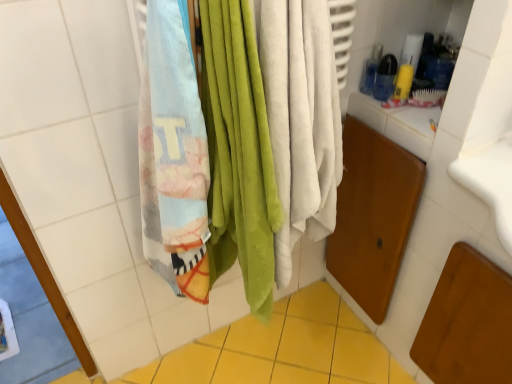
Question: Is multicolored cotton beach towel at left shorter than yellow ceramic tile at lower center?

Choices:
 (A) no
 (B) yes

Answer: (A)

Question: Is multicolored cotton beach towel at left oriented towards yellow ceramic tile at lower center?

Choices:
 (A) yes
 (B) no

Answer: (B)

Question: Does multicolored cotton beach towel at left appear on the left side of yellow ceramic tile at lower center?

Choices:
 (A) no
 (B) yes

Answer: (A)

Question: From a real-world perspective, is multicolored cotton beach towel at left below yellow ceramic tile at lower center?

Choices:
 (A) no
 (B) yes

Answer: (A)

Question: Can you confirm if multicolored cotton beach towel at left is thinner than yellow ceramic tile at lower center?

Choices:
 (A) yes
 (B) no

Answer: (A)

Question: Is multicolored cotton beach towel at left oriented away from yellow ceramic tile at lower center?

Choices:
 (A) no
 (B) yes

Answer: (A)

Question: Is yellow ceramic tile at lower center not within multicolored cotton beach towel at left?

Choices:
 (A) yes
 (B) no

Answer: (A)

Question: Are yellow ceramic tile at lower center and multicolored cotton beach towel at left beside each other?

Choices:
 (A) yes
 (B) no

Answer: (B)

Question: Can you confirm if yellow ceramic tile at lower center is wider than multicolored cotton beach towel at left?

Choices:
 (A) yes
 (B) no

Answer: (A)

Question: Is yellow ceramic tile at lower center at the left side of multicolored cotton beach towel at left?

Choices:
 (A) no
 (B) yes

Answer: (B)

Question: From the image's perspective, would you say yellow ceramic tile at lower center is positioned over multicolored cotton beach towel at left?

Choices:
 (A) no
 (B) yes

Answer: (A)

Question: Could multicolored cotton beach towel at left be considered to be inside yellow ceramic tile at lower center?

Choices:
 (A) no
 (B) yes

Answer: (A)

Question: In the image, is multicolored cotton beach towel at left on the left side or the right side of yellow ceramic tile at lower center?

Choices:
 (A) left
 (B) right

Answer: (B)